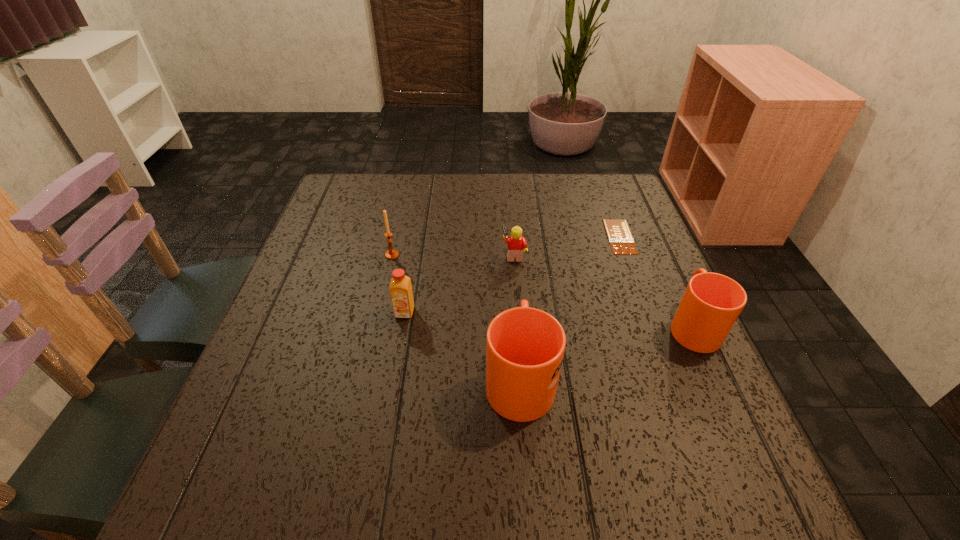
Where is `vacant position in the image that satisfies the following two spatial constraints: 1. on the handle side of the chocolate bar; 2. on the left side of the taller mug`? This screenshot has width=960, height=540. vacant position in the image that satisfies the following two spatial constraints: 1. on the handle side of the chocolate bar; 2. on the left side of the taller mug is located at coordinates (509, 237).